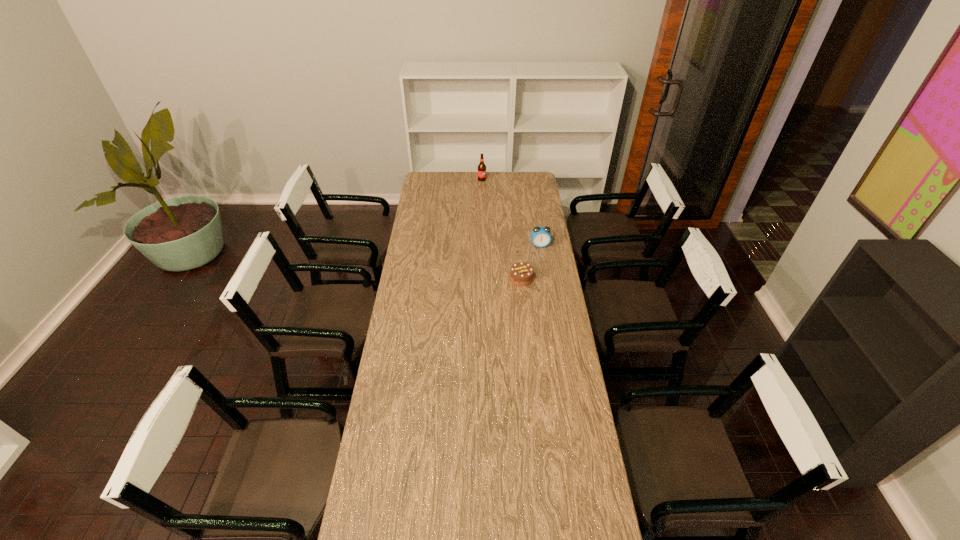
Image resolution: width=960 pixels, height=540 pixels. I want to click on the farthest object, so click(481, 167).

Where is `the leftmost object`? The image size is (960, 540). the leftmost object is located at coordinates (481, 167).

Locate an element on the screen. The image size is (960, 540). the rightmost object is located at coordinates (540, 236).

Find the location of `the second shortest object`. the second shortest object is located at coordinates (540, 236).

Find the location of a particular element. The width and height of the screenshot is (960, 540). the nearest object is located at coordinates (521, 273).

In order to click on the second object from left to right in this screenshot , I will do `click(521, 273)`.

The width and height of the screenshot is (960, 540). I want to click on vacant area located 0.270m on the right of the farthest object, so click(x=529, y=179).

Find the location of a particular element. vacant region located on the face of the second shortest object is located at coordinates (544, 270).

In order to click on free space located 0.350m on the back of the nearest object in this screenshot , I will do pos(516,228).

Where is `object that is positioned at the far edge`? This screenshot has width=960, height=540. object that is positioned at the far edge is located at coordinates (481, 167).